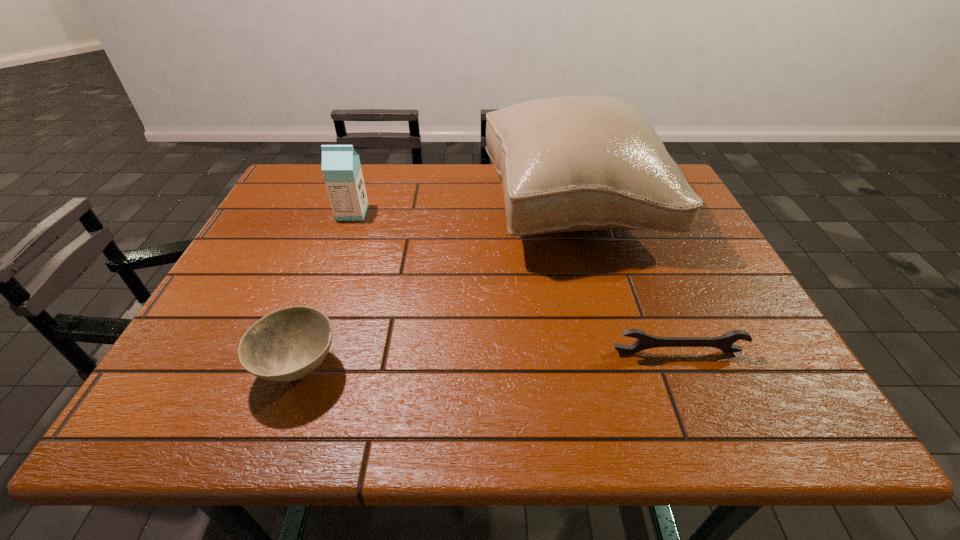
Where is `object that is at the near edge`? The image size is (960, 540). object that is at the near edge is located at coordinates (288, 344).

Where is `object that is at the left edge`? Image resolution: width=960 pixels, height=540 pixels. object that is at the left edge is located at coordinates (288, 344).

At what (x,y) coordinates should I click in order to perform the action: click on cushion that is positioned at the right edge. Please return your answer as a coordinate pair (x, y). Looking at the image, I should click on (572, 163).

This screenshot has height=540, width=960. Identify the location of wrench that is at the right edge. (645, 341).

What are the coordinates of `object at the near left corner` in the screenshot? It's located at (288, 344).

Find the location of a particular element. The image size is (960, 540). object that is positioned at the far right corner is located at coordinates coord(572,163).

Locate an element on the screen. The image size is (960, 540). vacant space at the far edge of the desktop is located at coordinates pos(427,166).

The width and height of the screenshot is (960, 540). Find the location of `free space at the near edge`. free space at the near edge is located at coordinates (604, 427).

Where is `vacant position at the left edge of the desktop`? The image size is (960, 540). vacant position at the left edge of the desktop is located at coordinates (254, 241).

In the image, there is a desktop. Where is `vacant space at the right edge`? vacant space at the right edge is located at coordinates (655, 247).